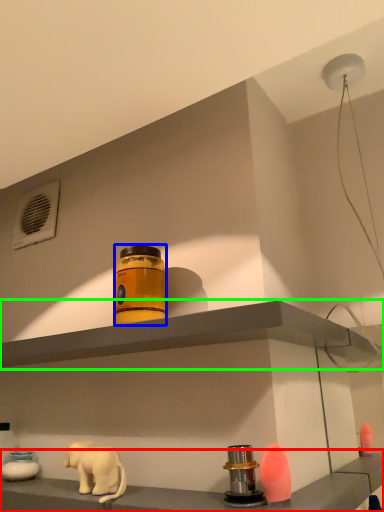
Question: Which object is positioned closest to shelf (highlighted by a red box)? Select from bottle (highlighted by a blue box) and shelf (highlighted by a green box).

Choices:
 (A) bottle
 (B) shelf

Answer: (B)